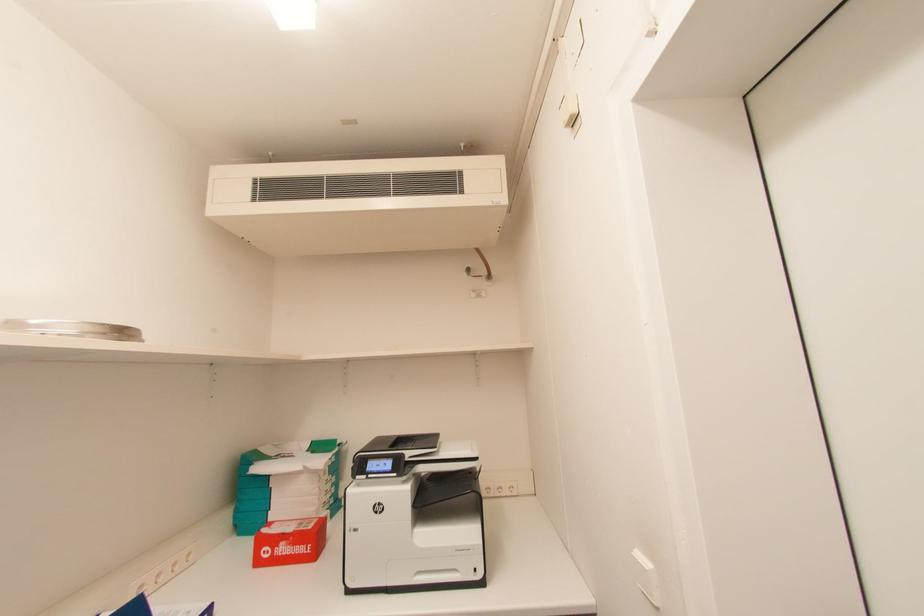
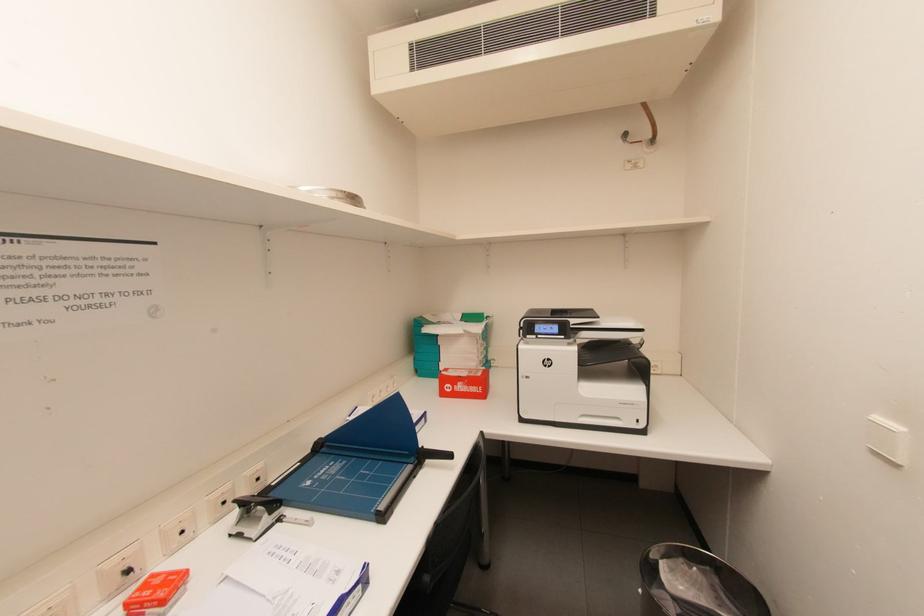
Question: The images are taken continuously from a first-person perspective. In which direction are you moving?

Choices:
 (A) Left
 (B) Right
 (C) Forward
 (D) Backward

Answer: (A)